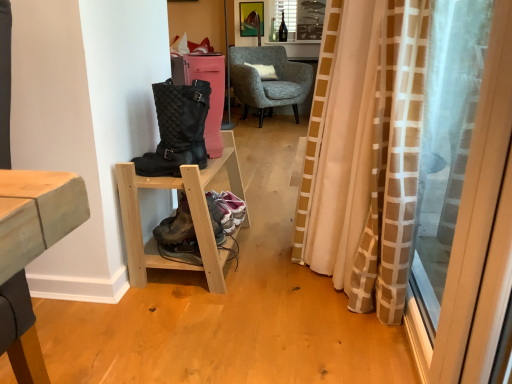
Question: Is light wood/unfinished wood shelf at lower left oriented away from metallic gold picture frame at upper center?

Choices:
 (A) no
 (B) yes

Answer: (A)

Question: Is light wood/unfinished wood shelf at lower left surrounding metallic gold picture frame at upper center?

Choices:
 (A) no
 (B) yes

Answer: (A)

Question: Does light wood/unfinished wood shelf at lower left appear on the right side of metallic gold picture frame at upper center?

Choices:
 (A) yes
 (B) no

Answer: (B)

Question: Is light wood/unfinished wood shelf at lower left not within metallic gold picture frame at upper center?

Choices:
 (A) no
 (B) yes

Answer: (B)

Question: Is light wood/unfinished wood shelf at lower left further to the viewer compared to metallic gold picture frame at upper center?

Choices:
 (A) yes
 (B) no

Answer: (B)

Question: From the image's perspective, is metallic gold picture frame at upper center above or below white soft cushion at center?

Choices:
 (A) below
 (B) above

Answer: (B)

Question: Is metallic gold picture frame at upper center taller or shorter than white soft cushion at center?

Choices:
 (A) short
 (B) tall

Answer: (B)

Question: Considering the positions of metallic gold picture frame at upper center and white soft cushion at center in the image, is metallic gold picture frame at upper center bigger or smaller than white soft cushion at center?

Choices:
 (A) big
 (B) small

Answer: (B)

Question: Considering their positions, is metallic gold picture frame at upper center located in front of or behind white soft cushion at center?

Choices:
 (A) front
 (B) behind

Answer: (B)

Question: In terms of height, does transparent plastic screen door at right look taller or shorter compared to beige/white checkered curtain at right?

Choices:
 (A) tall
 (B) short

Answer: (B)

Question: Is point pos(458,372) closer or farther from the camera than point pos(353,256)?

Choices:
 (A) farther
 (B) closer

Answer: (B)

Question: From a real-world perspective, relative to beige/white checkered curtain at right, is transparent plastic screen door at right vertically above or below?

Choices:
 (A) below
 (B) above

Answer: (B)

Question: From the image's perspective, relative to beige/white checkered curtain at right, is transparent plastic screen door at right above or below?

Choices:
 (A) above
 (B) below

Answer: (B)

Question: From the image's perspective, is leather/mesh hiking boots at lower center positioned above or below textured gray armchair at center?

Choices:
 (A) above
 (B) below

Answer: (B)

Question: Relative to textured gray armchair at center, is leather/mesh hiking boots at lower center in front or behind?

Choices:
 (A) front
 (B) behind

Answer: (A)